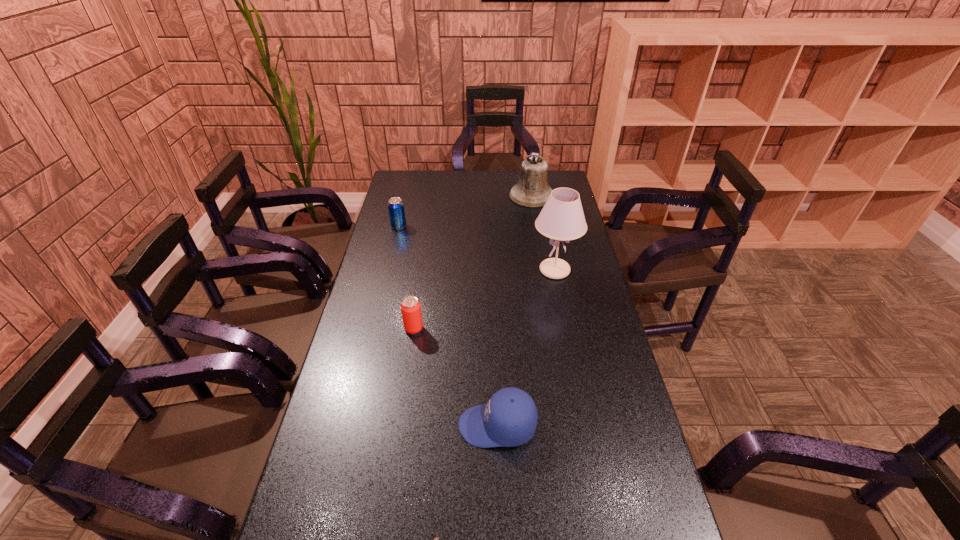
Where is `the tallest object`? The width and height of the screenshot is (960, 540). the tallest object is located at coordinates (562, 218).

At what (x,y) coordinates should I click in order to perform the action: click on lampshade. Please return your answer as a coordinate pair (x, y). The image size is (960, 540). Looking at the image, I should click on (562, 218).

Locate an element on the screen. This screenshot has width=960, height=540. the second tallest object is located at coordinates (532, 190).

The image size is (960, 540). Find the location of `the farthest object`. the farthest object is located at coordinates (532, 190).

The image size is (960, 540). What are the coordinates of `the leftmost object` in the screenshot? It's located at (396, 210).

Locate an element on the screen. The image size is (960, 540). the second farthest object is located at coordinates (396, 210).

Find the location of `the nearer beer can`. the nearer beer can is located at coordinates (410, 307).

Where is `the right beer can`? The height and width of the screenshot is (540, 960). the right beer can is located at coordinates (410, 307).

You are a GUI agent. You are given a task and a screenshot of the screen. Output one action in this format:
    pyautogui.click(x=<x>, y=<y>)
    Task: Click on the cap
    This screenshot has height=540, width=960.
    Given the screenshot: What is the action you would take?
    pyautogui.click(x=509, y=418)

At what (x,y) coordinates should I click in order to perform the action: click on free space located on the left of the tallest object. Please return your answer as a coordinate pair (x, y). The image size is (960, 540). Looking at the image, I should click on (464, 270).